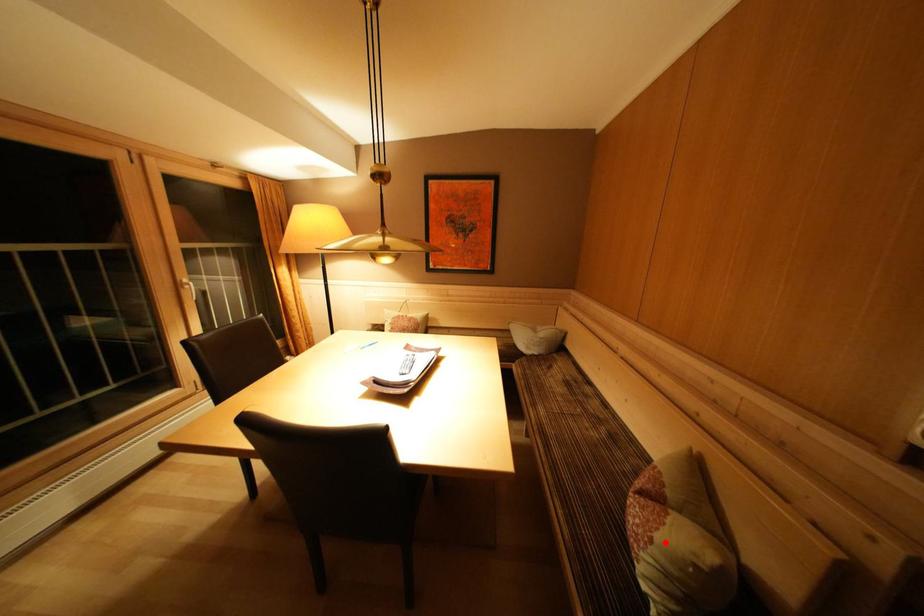
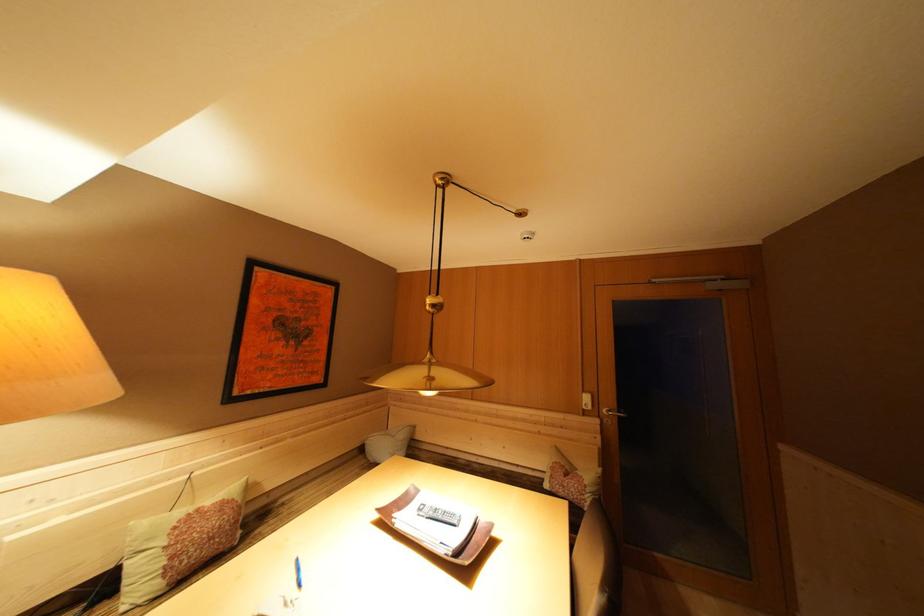
Locate, in the second image, the point that corresponds to the highlighted location in the first image.

(592, 487)